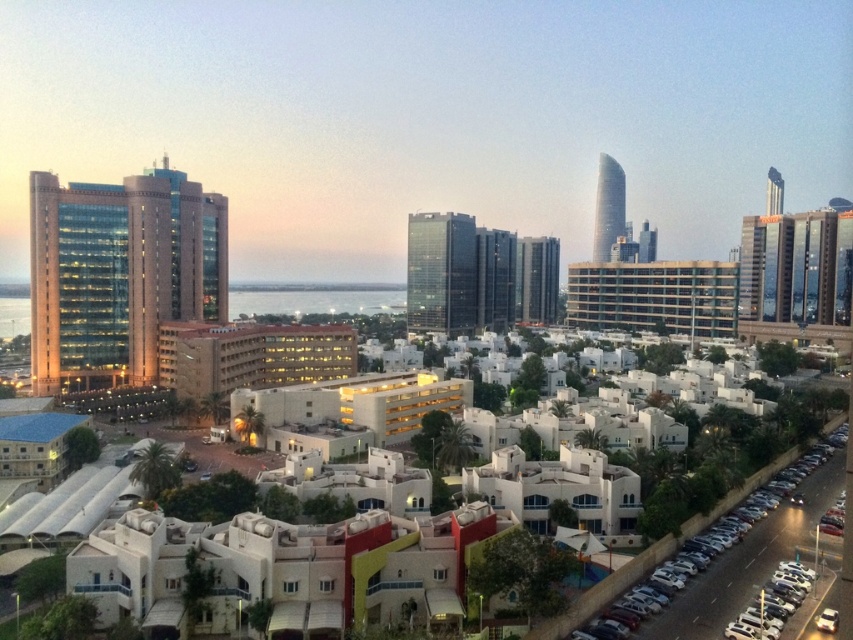
Who is positioned more to the left, metallic silver car at lower right or silver metallic car at lower right?

Positioned to the left is silver metallic car at lower right.

Does metallic silver car at lower right appear over silver metallic car at lower right?

Yes, metallic silver car at lower right is above silver metallic car at lower right.

Is point (775, 467) positioned behind point (807, 577)?

Yes, point (775, 467) is behind point (807, 577).

Where is `metallic silver car at lower right`? metallic silver car at lower right is located at coordinates (672, 541).